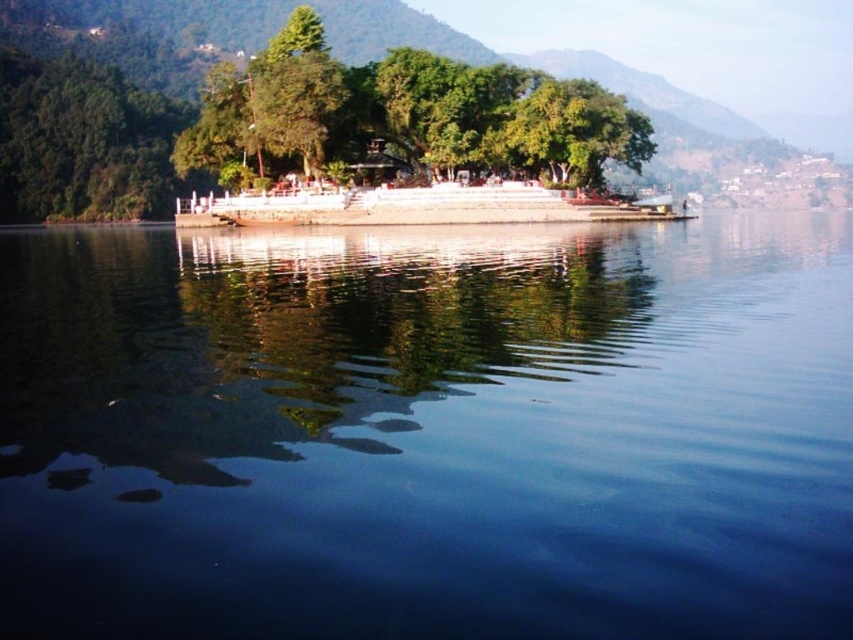
Does transparent blue water at center have a lesser height compared to green leafy tree at center?

Correct, transparent blue water at center is not as tall as green leafy tree at center.

Is transparent blue water at center bigger than green leafy tree at center?

Actually, transparent blue water at center might be smaller than green leafy tree at center.

What do you see at coordinates (428, 429) in the screenshot?
I see `transparent blue water at center` at bounding box center [428, 429].

You are a GUI agent. You are given a task and a screenshot of the screen. Output one action in this format:
    pyautogui.click(x=<x>, y=<y>)
    Task: Click on the transparent blue water at center
    The height and width of the screenshot is (640, 853).
    Given the screenshot: What is the action you would take?
    pyautogui.click(x=428, y=429)